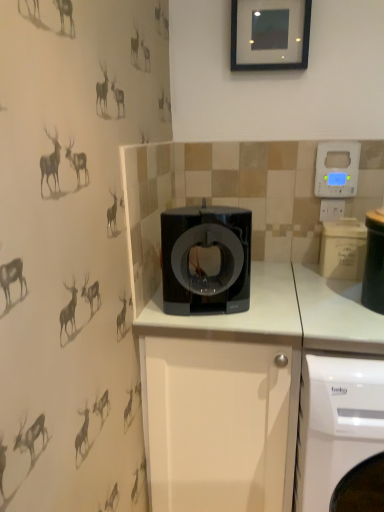
Question: Is blue plastic thermostat at upper right at the back of white matte cabinet at center?

Choices:
 (A) no
 (B) yes

Answer: (A)

Question: Can you confirm if white matte cabinet at center is thinner than blue plastic thermostat at upper right?

Choices:
 (A) yes
 (B) no

Answer: (B)

Question: From a real-world perspective, does white matte cabinet at center stand above blue plastic thermostat at upper right?

Choices:
 (A) no
 (B) yes

Answer: (A)

Question: Is white matte cabinet at center bigger than blue plastic thermostat at upper right?

Choices:
 (A) yes
 (B) no

Answer: (A)

Question: Is white matte cabinet at center positioned before blue plastic thermostat at upper right?

Choices:
 (A) yes
 (B) no

Answer: (A)

Question: Is white glossy washing machine at lower right taller or shorter than black glossy coffee machine at center?

Choices:
 (A) tall
 (B) short

Answer: (A)

Question: Is white glossy washing machine at lower right in front of or behind black glossy coffee machine at center in the image?

Choices:
 (A) front
 (B) behind

Answer: (A)

Question: Would you say white glossy washing machine at lower right is to the left or to the right of black glossy coffee machine at center in the picture?

Choices:
 (A) right
 (B) left

Answer: (A)

Question: Which is correct: white glossy washing machine at lower right is inside black glossy coffee machine at center, or outside of it?

Choices:
 (A) inside
 (B) outside

Answer: (B)

Question: Would you say black glossy coffee machine at center is to the left or to the right of black glossy picture frame at upper center in the picture?

Choices:
 (A) left
 (B) right

Answer: (A)

Question: From the image's perspective, relative to black glossy picture frame at upper center, is black glossy coffee machine at center above or below?

Choices:
 (A) below
 (B) above

Answer: (A)

Question: Considering the positions of black glossy coffee machine at center and black glossy picture frame at upper center in the image, is black glossy coffee machine at center bigger or smaller than black glossy picture frame at upper center?

Choices:
 (A) big
 (B) small

Answer: (A)

Question: Which is correct: black glossy coffee machine at center is inside black glossy picture frame at upper center, or outside of it?

Choices:
 (A) outside
 (B) inside

Answer: (A)

Question: Is blue plastic thermostat at upper right bigger or smaller than white plastic electric outlet at upper right?

Choices:
 (A) big
 (B) small

Answer: (A)

Question: From a real-world perspective, is blue plastic thermostat at upper right physically located above or below white plastic electric outlet at upper right?

Choices:
 (A) below
 (B) above

Answer: (B)